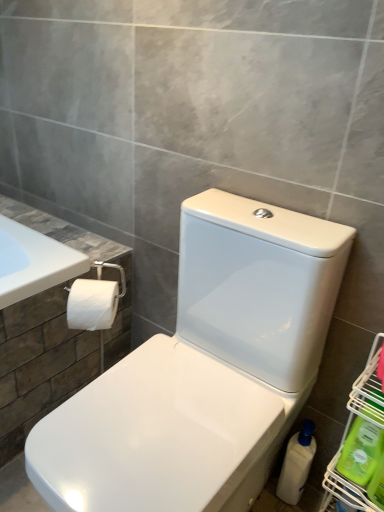
Question: Is green plastic bottle at lower right, which is counted as the first cleaning product, starting from the front, not near white glossy toilet at center?

Choices:
 (A) yes
 (B) no

Answer: (B)

Question: Does green plastic bottle at lower right, which is counted as the first cleaning product, starting from the front, have a greater width compared to white glossy toilet at center?

Choices:
 (A) yes
 (B) no

Answer: (B)

Question: Is green plastic bottle at lower right, which is counted as the first cleaning product, starting from the front, further to the viewer compared to white glossy toilet at center?

Choices:
 (A) no
 (B) yes

Answer: (B)

Question: Is green plastic bottle at lower right, the 3th cleaning product from the back, closer to the viewer compared to white glossy toilet at center?

Choices:
 (A) yes
 (B) no

Answer: (B)

Question: From the image's perspective, does green plastic bottle at lower right, which is counted as the first cleaning product, starting from the front, appear lower than white glossy toilet at center?

Choices:
 (A) yes
 (B) no

Answer: (A)

Question: From the image's perspective, is green plastic bottle at lower right, which is counted as the first cleaning product, starting from the front, on white glossy toilet at center?

Choices:
 (A) no
 (B) yes

Answer: (A)

Question: Is green plastic cleaning product at lower right, the second cleaning product from the front, aimed at white matte toilet paper at left?

Choices:
 (A) yes
 (B) no

Answer: (B)

Question: Is white matte toilet paper at left at the back of green plastic cleaning product at lower right, which appears as the second cleaning product when viewed from the back?

Choices:
 (A) yes
 (B) no

Answer: (B)

Question: Considering the relative sizes of green plastic cleaning product at lower right, the second cleaning product from the front, and white matte toilet paper at left in the image provided, is green plastic cleaning product at lower right, the second cleaning product from the front, shorter than white matte toilet paper at left?

Choices:
 (A) no
 (B) yes

Answer: (A)

Question: Is green plastic cleaning product at lower right, the second cleaning product from the front, to the left of white matte toilet paper at left from the viewer's perspective?

Choices:
 (A) yes
 (B) no

Answer: (B)

Question: From a real-world perspective, is green plastic cleaning product at lower right, the second cleaning product from the front, located higher than white matte toilet paper at left?

Choices:
 (A) yes
 (B) no

Answer: (B)

Question: From the image's perspective, is green plastic cleaning product at lower right, which appears as the second cleaning product when viewed from the back, located beneath white matte toilet paper at left?

Choices:
 (A) no
 (B) yes

Answer: (B)

Question: Considering the relative sizes of green plastic bottle at lower right, which is counted as the first cleaning product, starting from the front, and white plastic bottle at lower right, the third cleaning product viewed from the front, in the image provided, is green plastic bottle at lower right, which is counted as the first cleaning product, starting from the front, wider than white plastic bottle at lower right, the third cleaning product viewed from the front,?

Choices:
 (A) no
 (B) yes

Answer: (A)